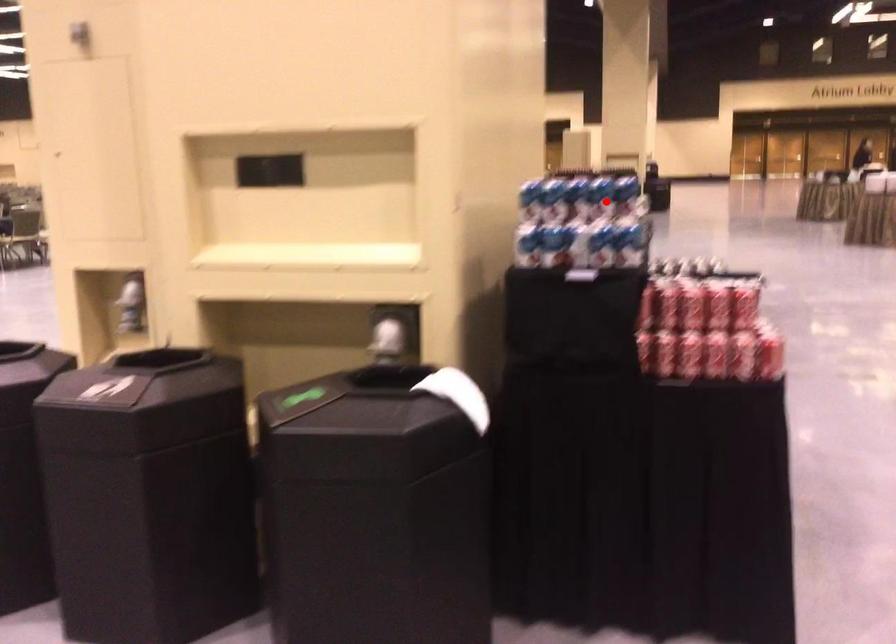
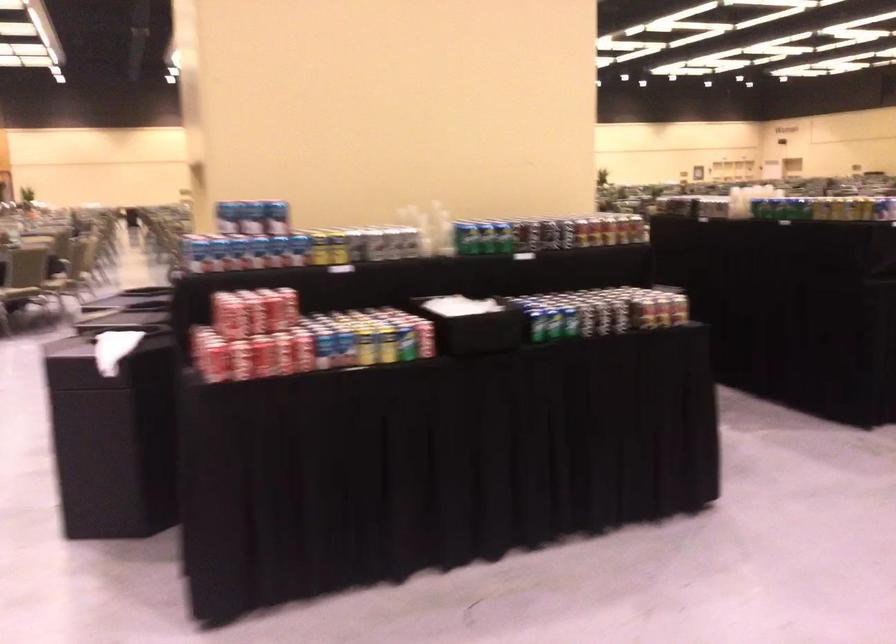
Question: I am providing you with two images of the same scene from different viewpoints. In image1, a red point is highlighted. Considering the same 3D point in image2, which of the following is correct?

Choices:
 (A) It is closer
 (B) It is farther

Answer: (B)